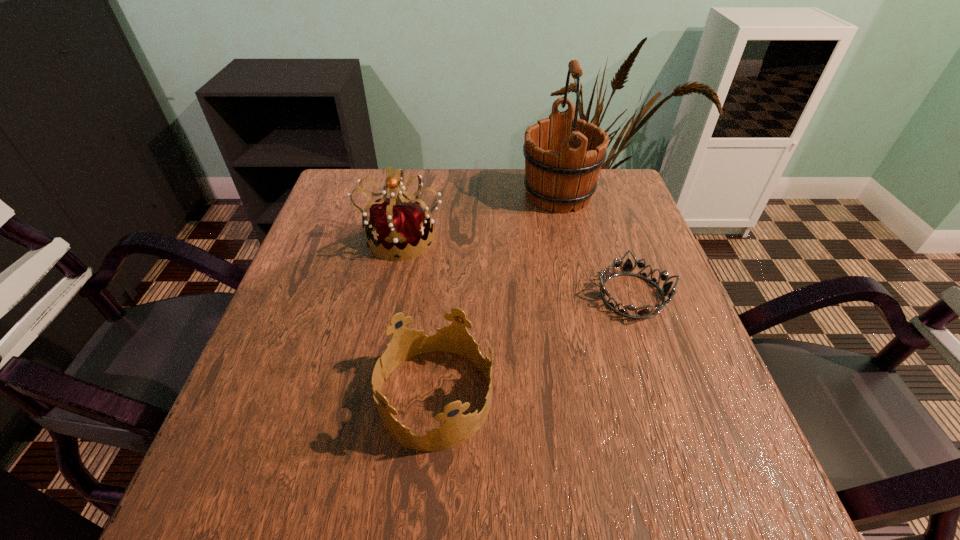
Find the location of a particular element. The image size is (960, 540). free space between the third shortest object and the shortest tiara is located at coordinates (517, 266).

The height and width of the screenshot is (540, 960). What are the coordinates of `free space between the farthest tiara and the wine bucket` in the screenshot? It's located at (480, 215).

The height and width of the screenshot is (540, 960). What are the coordinates of `vacant area that lies between the wine bucket and the second shortest object` in the screenshot? It's located at (496, 296).

Where is `vacant area between the second shortest tiara and the tallest object`? The height and width of the screenshot is (540, 960). vacant area between the second shortest tiara and the tallest object is located at coordinates (496, 296).

In order to click on free point between the nearest tiara and the farthest tiara in this screenshot , I will do `click(418, 316)`.

At what (x,y) coordinates should I click in order to perform the action: click on object that is the third closest to the nearest object. Please return your answer as a coordinate pair (x, y). This screenshot has height=540, width=960. Looking at the image, I should click on (563, 158).

This screenshot has width=960, height=540. In order to click on object that stands as the second closest to the third shortest object in this screenshot , I will do coord(405,343).

Identify which tiara is the nearest to the second tallest tiara. Please provide its 2D coordinates. Your answer should be formatted as a tuple, i.e. [(x, y)], where the tuple contains the x and y coordinates of a point satisfying the conditions above.

[(627, 268)]

Where is `tiara identified as the second closest to the third farthest object`? tiara identified as the second closest to the third farthest object is located at coordinates (397, 223).

The image size is (960, 540). Identify the location of free location that satisfies the following two spatial constraints: 1. on the front side of the tallest object; 2. on the front-facing side of the nearest object. (604, 397).